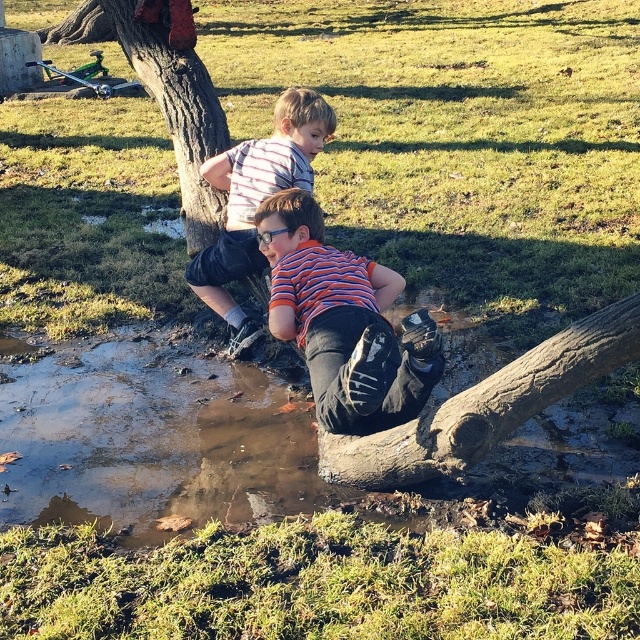
Between point (134, 440) and point (323, 134), which one is positioned behind?

The point (323, 134) is more distant.

Measure the distance between point (280,445) and camera.

Point (280,445) is 14.49 feet away from camera.

What are the coordinates of `muddy log at lower center` in the screenshot? It's located at (282, 433).

Does brown rough log at lower center appear on the left side of striped shirt at center?

No, brown rough log at lower center is not to the left of striped shirt at center.

The width and height of the screenshot is (640, 640). What are the coordinates of `brown rough log at lower center` in the screenshot? It's located at (486, 404).

Can you confirm if orange striped shirt at center is positioned below brown rough tree trunk at upper left?

Yes.

What do you see at coordinates (342, 321) in the screenshot? I see `orange striped shirt at center` at bounding box center [342, 321].

Who is more forward, (372, 355) or (205, 208)?

Positioned in front is point (372, 355).

The width and height of the screenshot is (640, 640). What are the coordinates of `orange striped shirt at center` in the screenshot? It's located at (342, 321).